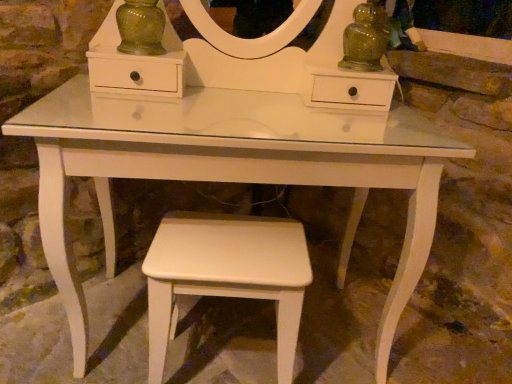
At what (x,y) coordinates should I click in order to perform the action: click on free space to the right of white matte stool at lower center. Please return your answer as a coordinate pair (x, y). This screenshot has height=384, width=512. Looking at the image, I should click on (329, 349).